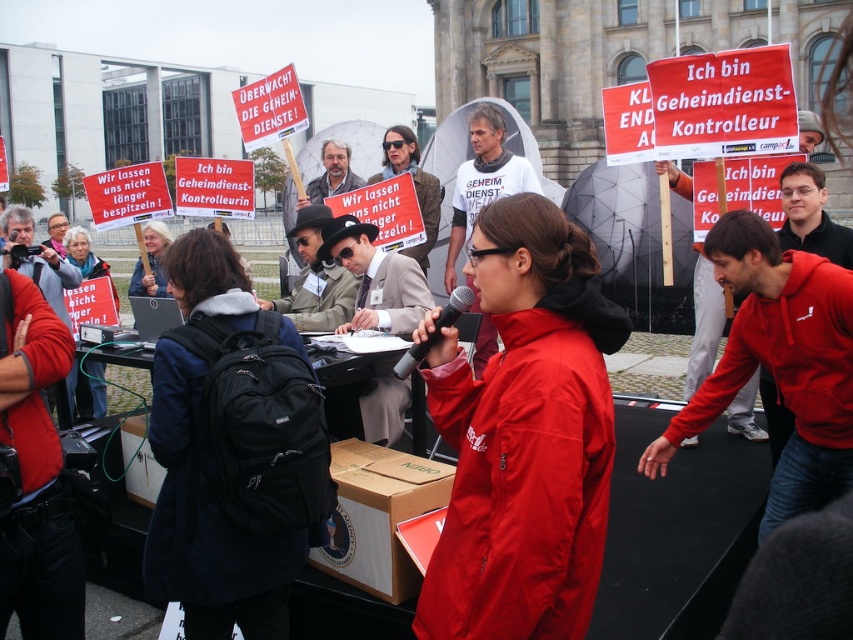
The height and width of the screenshot is (640, 853). Identify the location of red matte jacket at center. 524,435.

Find the location of a particular element. red matte jacket at center is located at coordinates (524, 435).

Who is more forward, (167, 268) or (97, 397)?

Point (167, 268) is more forward.

The width and height of the screenshot is (853, 640). What do you see at coordinates (231, 451) in the screenshot?
I see `black fabric backpack at center` at bounding box center [231, 451].

Which is in front, point (274, 499) or point (77, 365)?

Point (274, 499) is in front.

Where is `black fabric backpack at center`? Image resolution: width=853 pixels, height=640 pixels. black fabric backpack at center is located at coordinates tap(231, 451).

Locate an element on the screen. This screenshot has height=640, width=853. red matte jacket at center is located at coordinates (524, 435).

Does red matte jacket at center appear under matte black jacket at center?

Correct, red matte jacket at center is located below matte black jacket at center.

Which is behind, point (524, 326) or point (82, 260)?

The point (82, 260) is more distant.

I want to click on red matte jacket at center, so click(x=524, y=435).